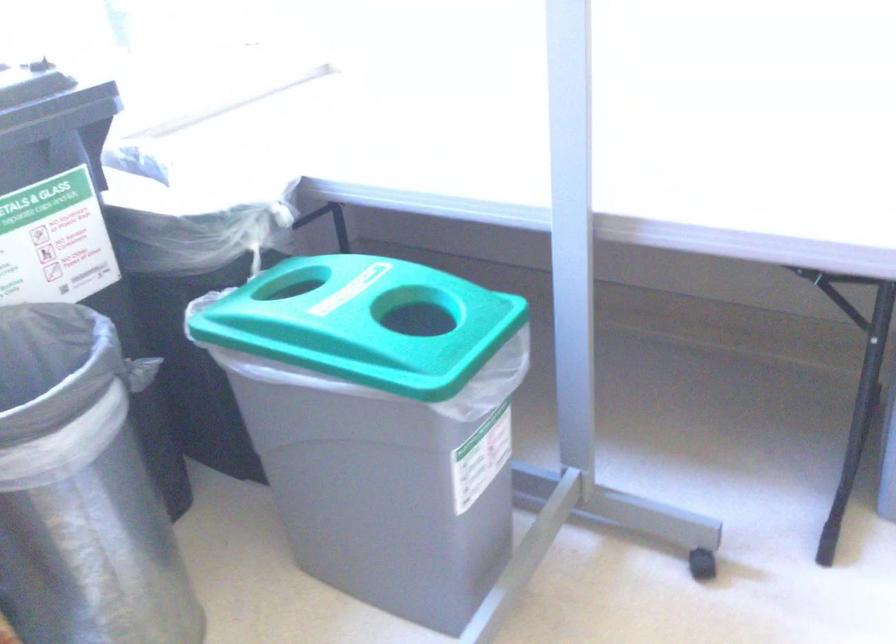
Identify the location of green recycling lid. The width and height of the screenshot is (896, 644). (349, 310).